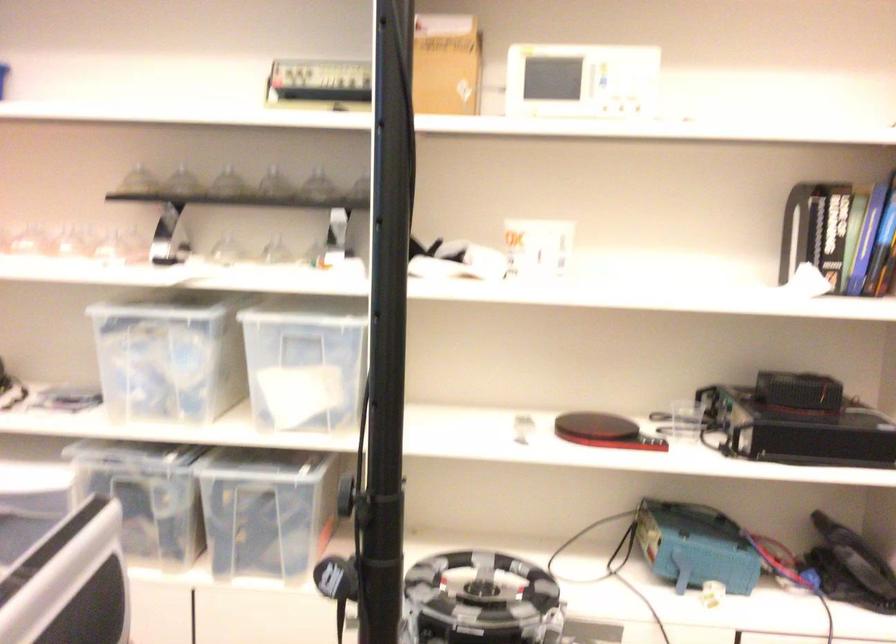
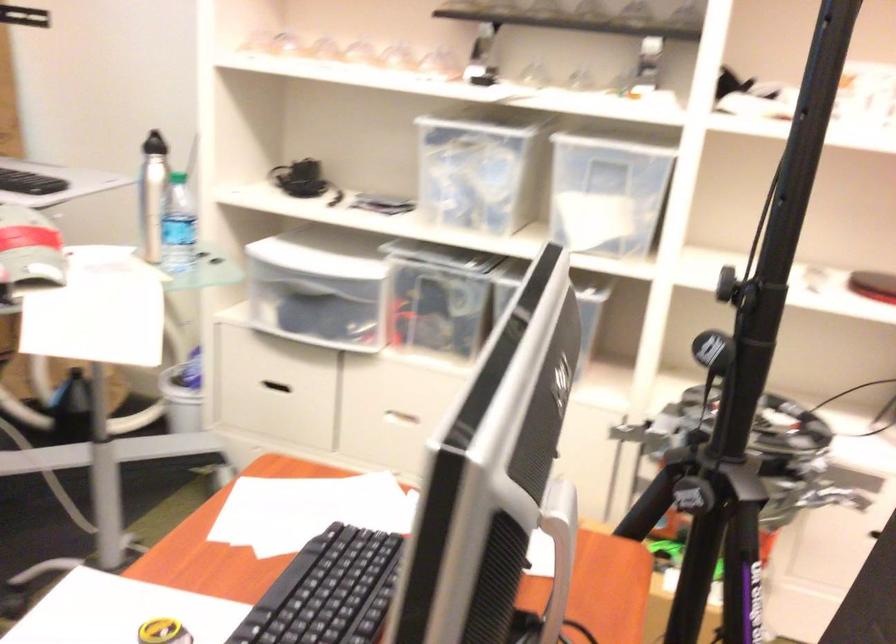
Find the pixel in the second image that matches [358,507] in the first image.

(728, 288)